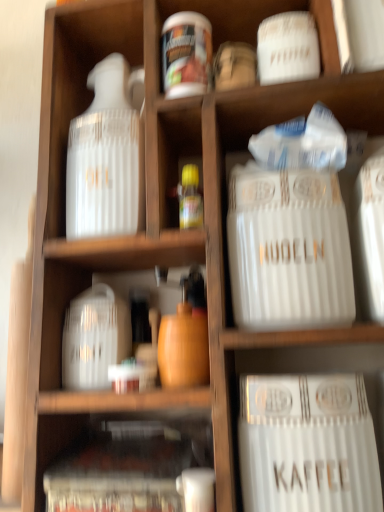
Question: Is white plastic container at center, the second cabinet from the bottom, in contact with white ceramic canister at center right?

Choices:
 (A) yes
 (B) no

Answer: (B)

Question: From a real-world perspective, is white plastic container at center, the second cabinet from the bottom, located higher than white ceramic canister at center right?

Choices:
 (A) yes
 (B) no

Answer: (B)

Question: From the image's perspective, is white plastic container at center, the second cabinet from the bottom, over white ceramic canister at center right?

Choices:
 (A) no
 (B) yes

Answer: (A)

Question: Is white plastic container at center, the second cabinet from the bottom, facing away from white ceramic canister at center right?

Choices:
 (A) no
 (B) yes

Answer: (A)

Question: Is white plastic container at center, which ranks as the first cabinet in top-to-bottom order, positioned before white ceramic canister at center right?

Choices:
 (A) no
 (B) yes

Answer: (A)

Question: Can you confirm if white plastic container at center, the second cabinet from the bottom, is wider than white ceramic canister at center right?

Choices:
 (A) no
 (B) yes

Answer: (B)

Question: Does white plastic container at center, the second cabinet from the bottom, have a lesser height compared to white glossy jar at left?

Choices:
 (A) yes
 (B) no

Answer: (A)

Question: From the image's perspective, is white plastic container at center, which ranks as the first cabinet in top-to-bottom order, over white glossy jar at left?

Choices:
 (A) no
 (B) yes

Answer: (A)

Question: Does white plastic container at center, which ranks as the first cabinet in top-to-bottom order, have a lesser width compared to white glossy jar at left?

Choices:
 (A) yes
 (B) no

Answer: (A)

Question: Can you confirm if white plastic container at center, which ranks as the first cabinet in top-to-bottom order, is smaller than white glossy jar at left?

Choices:
 (A) no
 (B) yes

Answer: (B)

Question: Can you see white plastic container at center, which ranks as the first cabinet in top-to-bottom order, touching white glossy jar at left?

Choices:
 (A) yes
 (B) no

Answer: (A)

Question: Can you confirm if white plastic container at center, the second cabinet from the bottom, is positioned to the left of white glossy jar at left?

Choices:
 (A) no
 (B) yes

Answer: (A)

Question: Is white ceramic canister at center right at the right side of white glossy jar at upper center?

Choices:
 (A) no
 (B) yes

Answer: (B)